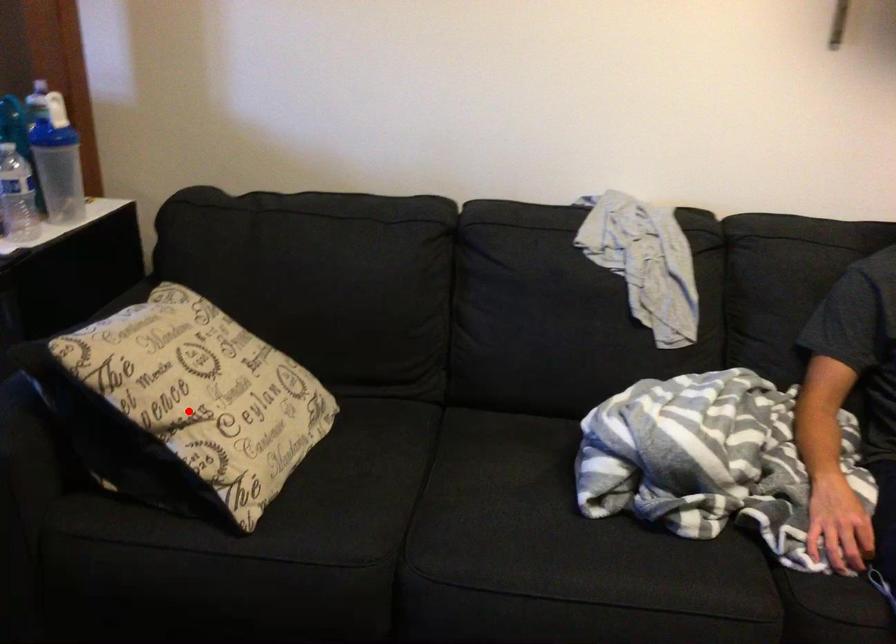
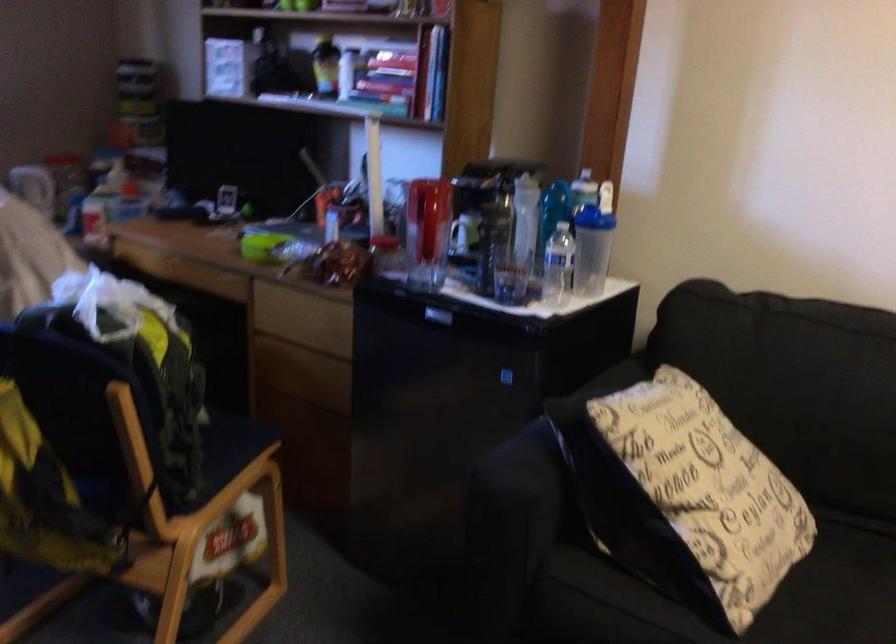
Find the pixel in the second image that matches the highlighted location in the first image.

(694, 496)